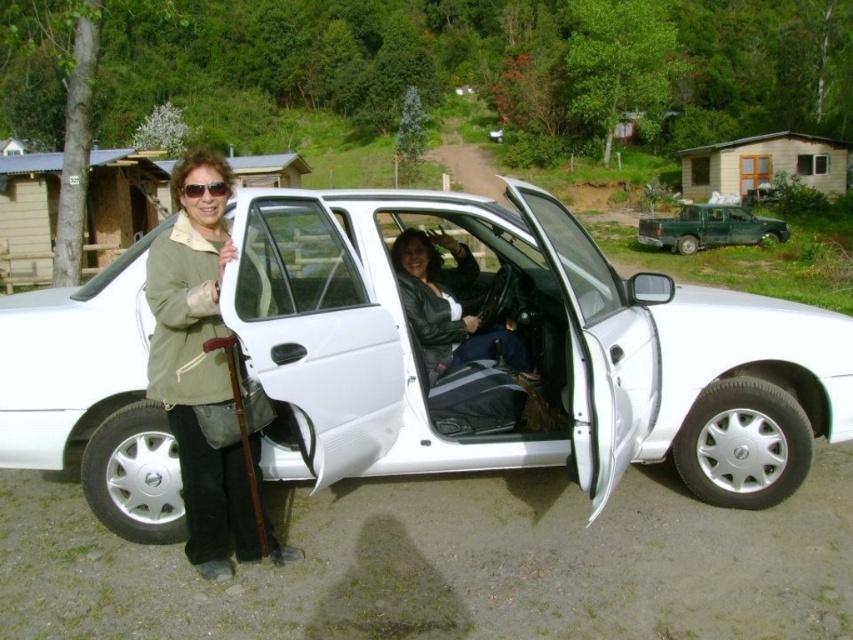
You are a delivery driver who needs to park your truck near the green matte jacket at left. The parking area has a maximum distance limit of 75 feet between the truck and the delivery location. Can you park the green matte truck at upper right within the allowed distance?

The green matte jacket at left is 73.41 feet from the green matte truck at upper right. Since 73.41 feet is within the 75 feet limit, you can park the green matte truck at upper right within the allowed distance.

You are a photographer standing in front of the scene. You want to take a photo that includes both the green matte jacket at left and the green matte truck at upper right. Which object should you focus on first to ensure both are in sharp focus?

You should focus on the green matte jacket at left first because it is closer to the viewer than the green matte truck at upper right. By focusing on the closer object, the truck will still be within the depth of field and remain sharp in the photo.

You are a photographer trying to capture a candid shot of the two people near the white car. You want to ensure that both the green matte jacket at left and the sunglasses at left are clearly visible in the frame. Based on their positions, which object should you focus on first to ensure they are both in focus?

The green matte jacket at left is taller than sunglasses at left, so focusing on the green matte jacket at left first will help ensure both objects are in focus since it is the larger object in the scene.